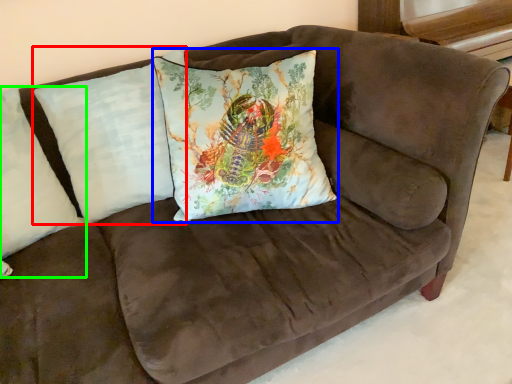
Question: Which is nearer to the pillow (highlighted by a red box)? pillow (highlighted by a blue box) or pillow (highlighted by a green box).

Choices:
 (A) pillow
 (B) pillow

Answer: (B)